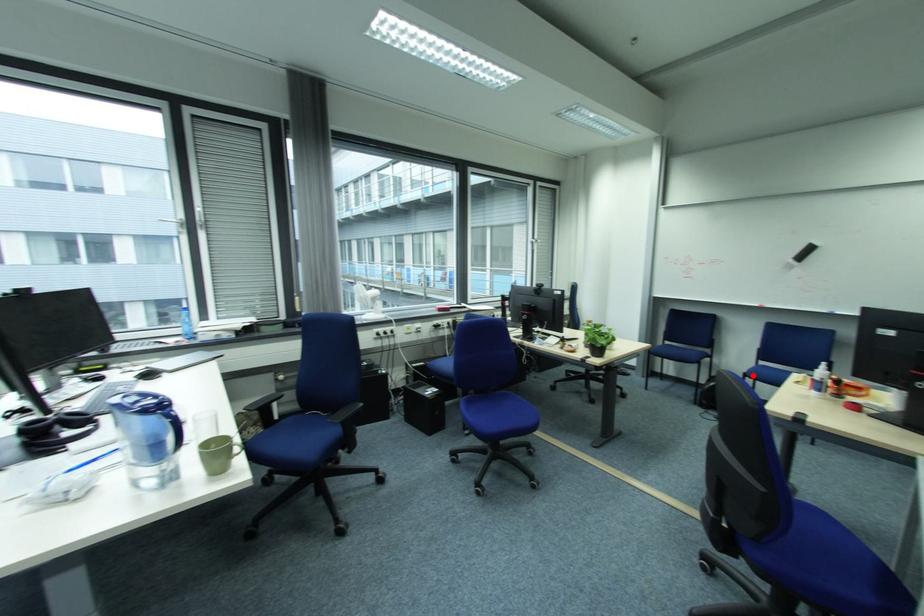
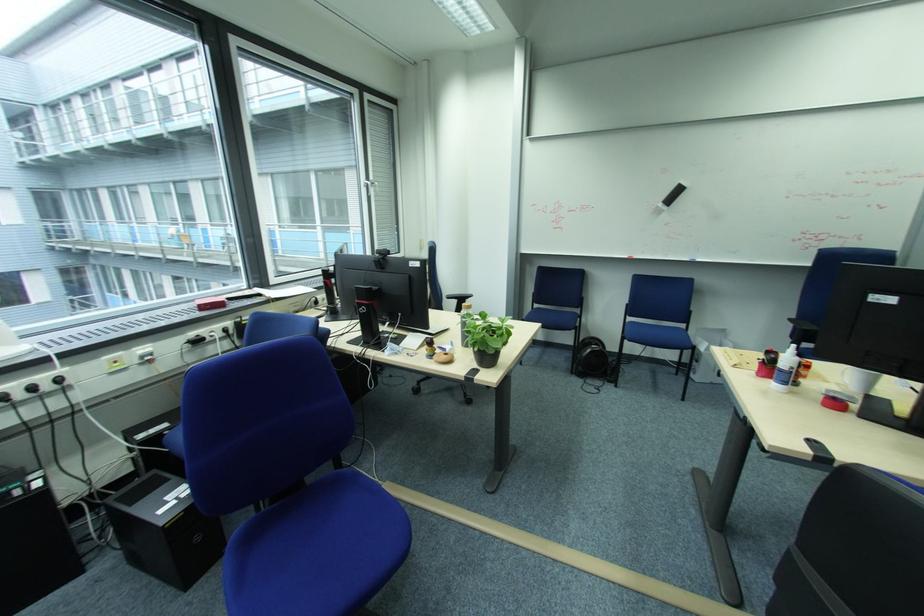
Question: A red point is marked in image1. In image2, is the corresponding 3D point closer to the camera or farther? Reply with the corresponding letter.

Choices:
 (A) The corresponding 3D point is closer.
 (B) The corresponding 3D point is farther.

Answer: (A)